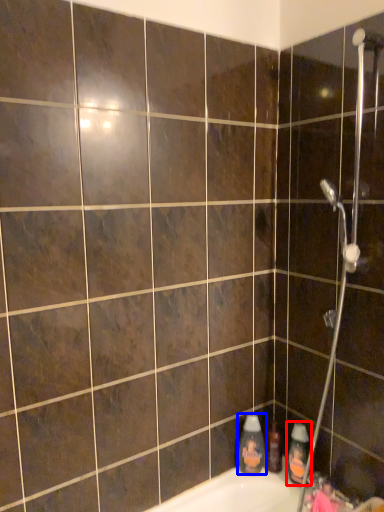
Question: Which point is further to the camera, cleaning product (highlighted by a red box) or cleaning product (highlighted by a blue box)?

Choices:
 (A) cleaning product
 (B) cleaning product

Answer: (B)